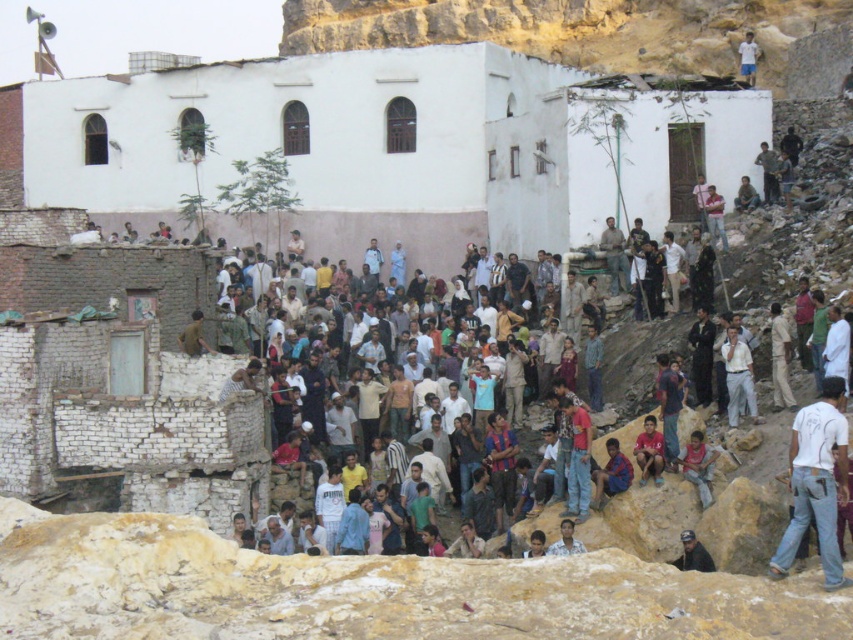
Between white cotton shirt at right and light brown leather jacket at upper right, which one is positioned lower?

white cotton shirt at right

Does white cotton shirt at right have a lesser height compared to light brown leather jacket at upper right?

In fact, white cotton shirt at right may be taller than light brown leather jacket at upper right.

Between point (746, 364) and point (773, 164), which one is positioned behind?

Point (773, 164)

I want to click on white cotton shirt at right, so click(x=738, y=376).

Does white rough stone wall at upper center have a greater height compared to light brown fabric shirt at upper right?

Indeed, white rough stone wall at upper center has a greater height compared to light brown fabric shirt at upper right.

Does white rough stone wall at upper center have a greater width compared to light brown fabric shirt at upper right?

Yes, white rough stone wall at upper center is wider than light brown fabric shirt at upper right.

The image size is (853, 640). I want to click on white rough stone wall at upper center, so click(x=572, y=29).

Where is `white rough stone wall at upper center`? The image size is (853, 640). white rough stone wall at upper center is located at coordinates (572, 29).

Who is lower down, light brown fabric shirt at lower right or dark gray fabric cap at lower right?

A: dark gray fabric cap at lower right is below.

Is point (706, 497) farther from viewer compared to point (695, 544)?

Yes.

You are a GUI agent. You are given a task and a screenshot of the screen. Output one action in this format:
    pyautogui.click(x=<x>, y=<y>)
    Task: Click on the light brown fabric shirt at lower right
    
    Given the screenshot: What is the action you would take?
    point(698,465)